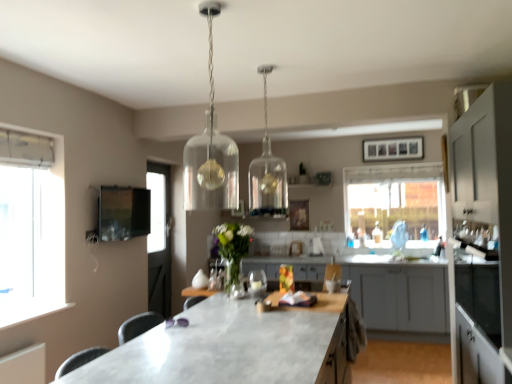
The width and height of the screenshot is (512, 384). I want to click on empty space that is ontop of clear glass pendant light at upper center, positioned as the first lamp in front-to-back order (from a real-world perspective), so click(210, 6).